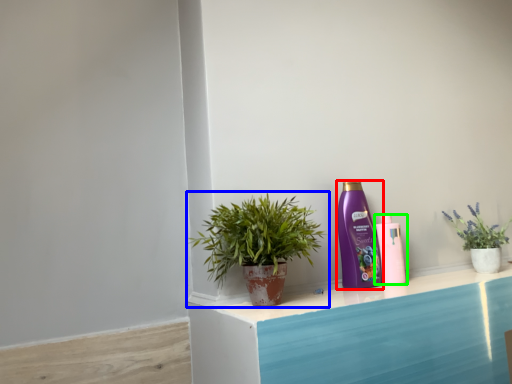
Question: Considering the real-world distances, which object is farthest from bottle (highlighted by a red box)? houseplant (highlighted by a blue box) or bottle (highlighted by a green box)?

Choices:
 (A) houseplant
 (B) bottle

Answer: (A)